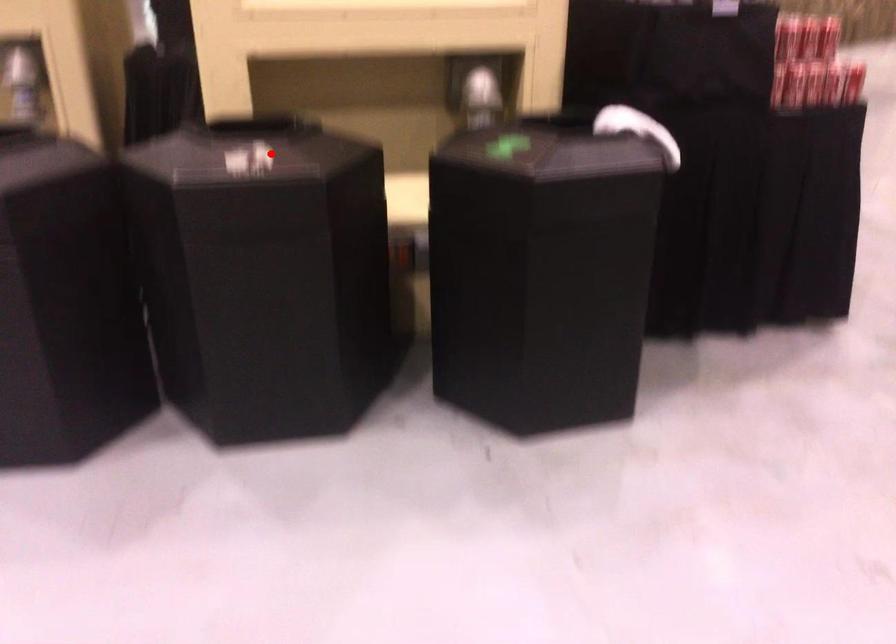
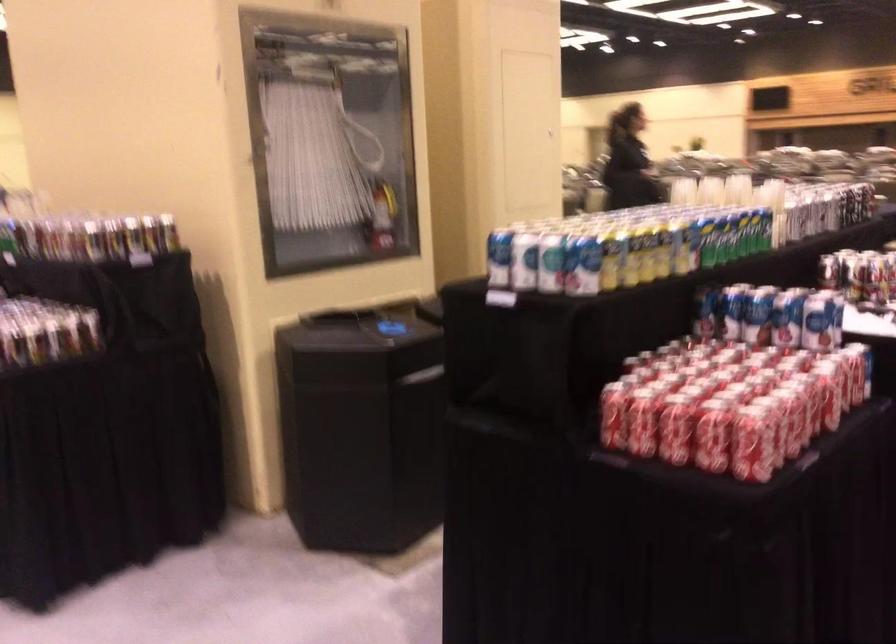
Question: I am providing you with two images of the same scene from different viewpoints. A red point is marked on the first image. Is the red point's position out of view in image 2?

Choices:
 (A) Yes
 (B) No

Answer: (A)